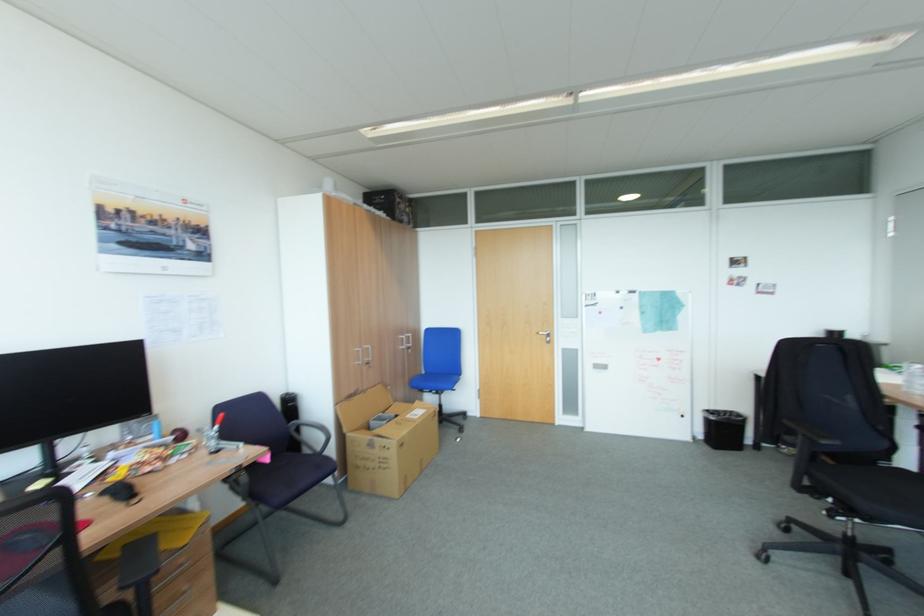
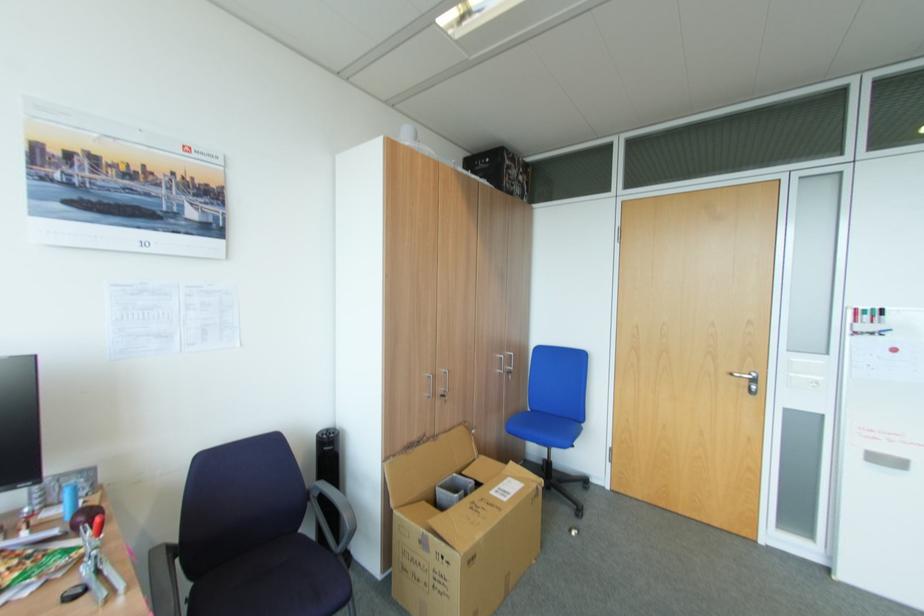
Locate, in the second image, the point that corresponds to (x=599, y=296) in the first image.

(880, 317)